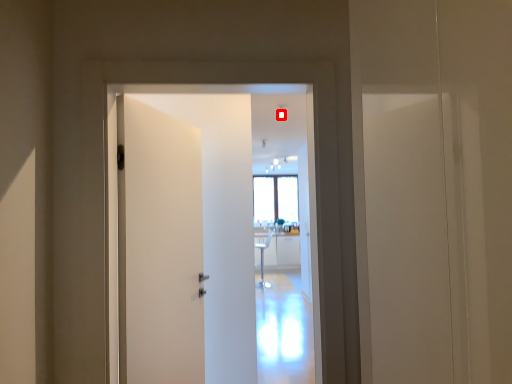
Question: From the image's perspective, considering the relative positions of light (annotated by the red box) and door in the image provided, where is light (annotated by the red box) located with respect to the staircase?

Choices:
 (A) above
 (B) below

Answer: (A)